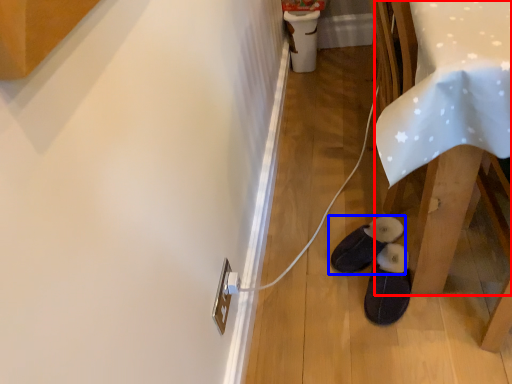
Question: Which object is closer to the camera taking this photo, table (highlighted by a red box) or footwear (highlighted by a blue box)?

Choices:
 (A) table
 (B) footwear

Answer: (A)